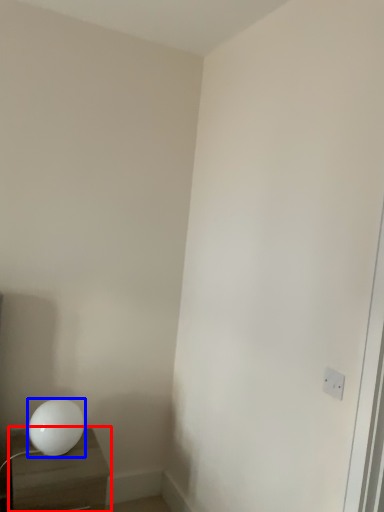
Question: Among these objects, which one is farthest to the camera, nightstand (highlighted by a red box) or lamp (highlighted by a blue box)?

Choices:
 (A) nightstand
 (B) lamp

Answer: (B)